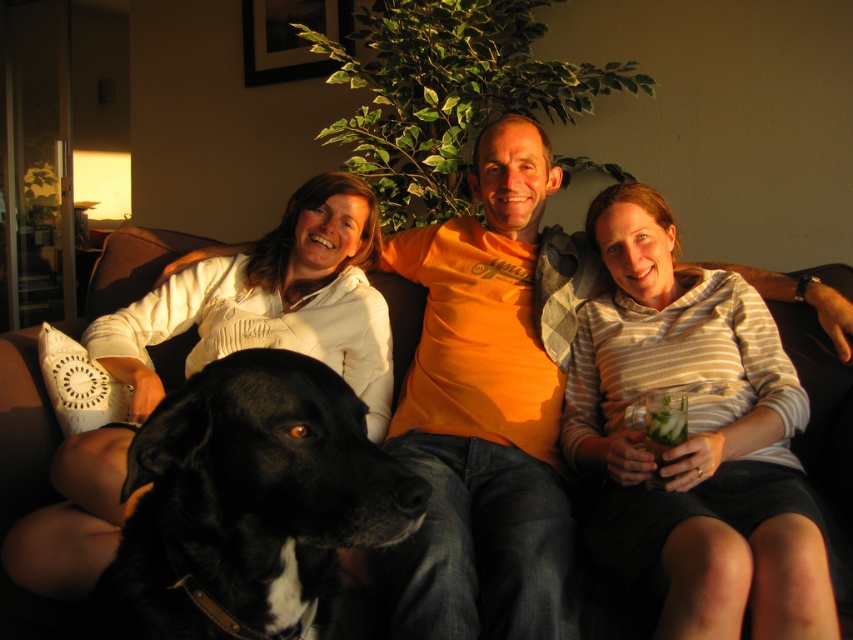
Question: Which of the following is the farthest from the observer?

Choices:
 (A) (146, 339)
 (B) (757, 616)
 (C) (282, 454)

Answer: (A)

Question: Which of the following is the farthest from the observer?

Choices:
 (A) (335, 216)
 (B) (287, 362)

Answer: (A)

Question: Is striped cotton shirt at center to the left of black leather dog at lower left from the viewer's perspective?

Choices:
 (A) yes
 (B) no

Answer: (B)

Question: Which object is positioned farthest from the black leather dog at lower left?

Choices:
 (A) striped cotton shirt at center
 (B) white cotton shirt at center

Answer: (B)

Question: Is black leather dog at lower left positioned at the back of white cotton shirt at center?

Choices:
 (A) no
 (B) yes

Answer: (A)

Question: Does black leather dog at lower left have a smaller size compared to white cotton shirt at center?

Choices:
 (A) yes
 (B) no

Answer: (A)